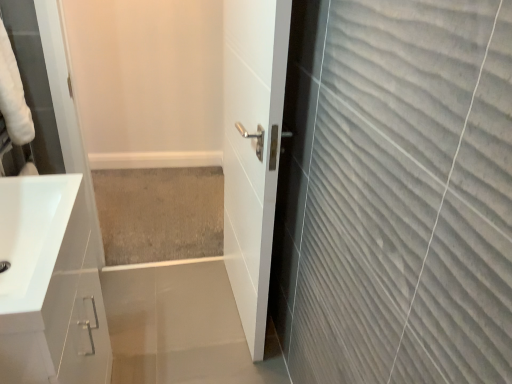
Question: Is white glossy sink at lower left not close to white glossy door at center?

Choices:
 (A) no
 (B) yes

Answer: (A)

Question: Does white glossy sink at lower left come in front of white glossy door at center?

Choices:
 (A) no
 (B) yes

Answer: (B)

Question: Does white glossy sink at lower left touch white glossy door at center?

Choices:
 (A) yes
 (B) no

Answer: (B)

Question: Does white glossy sink at lower left appear on the right side of white glossy door at center?

Choices:
 (A) yes
 (B) no

Answer: (B)

Question: From the image's perspective, is white glossy sink at lower left located beneath white glossy door at center?

Choices:
 (A) no
 (B) yes

Answer: (B)

Question: Is white glossy sink at lower left smaller than white glossy door at center?

Choices:
 (A) yes
 (B) no

Answer: (A)

Question: Is white glossy door at center not near beige carpet at center?

Choices:
 (A) no
 (B) yes

Answer: (A)

Question: Is white glossy door at center taller than beige carpet at center?

Choices:
 (A) no
 (B) yes

Answer: (B)

Question: Considering the relative sizes of white glossy door at center and beige carpet at center in the image provided, is white glossy door at center wider than beige carpet at center?

Choices:
 (A) no
 (B) yes

Answer: (A)

Question: Could you tell me if white glossy door at center is turned towards beige carpet at center?

Choices:
 (A) yes
 (B) no

Answer: (B)

Question: Considering the relative sizes of white glossy door at center and beige carpet at center in the image provided, is white glossy door at center thinner than beige carpet at center?

Choices:
 (A) yes
 (B) no

Answer: (A)

Question: Is the position of white glossy door at center less distant than that of beige carpet at center?

Choices:
 (A) yes
 (B) no

Answer: (A)

Question: Are white glossy door at center and white glossy sink at lower left located far from each other?

Choices:
 (A) yes
 (B) no

Answer: (B)